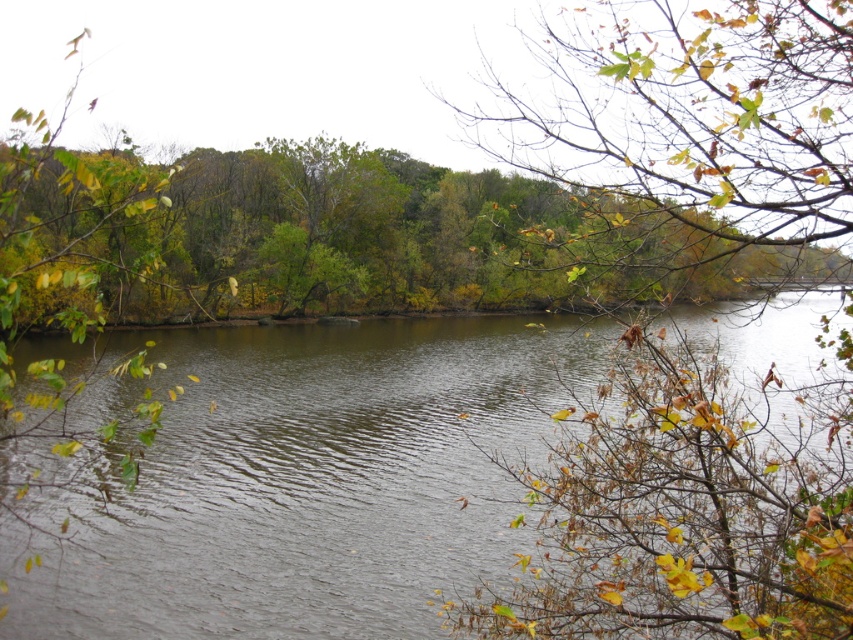
In the scene shown: Can you confirm if dark brown water at center is wider than green matte leaves at upper right?

Indeed, dark brown water at center has a greater width compared to green matte leaves at upper right.

Is dark brown water at center bigger than green matte leaves at upper right?

Yes.

Is point (18, 560) closer to camera compared to point (735, 104)?

No.

Where is `dark brown water at center`? Image resolution: width=853 pixels, height=640 pixels. dark brown water at center is located at coordinates (312, 483).

Is point (67, 580) farther from viewer compared to point (135, 248)?

That is False.

Is dark brown water at center bigger than green leafy tree at upper center?

No.

Between point (115, 628) and point (468, 196), which one is positioned behind?

The point (468, 196) is behind.

At what (x,y) coordinates should I click in order to perform the action: click on dark brown water at center. Please return your answer as a coordinate pair (x, y). Looking at the image, I should click on (312, 483).

Who is more forward, (x=844, y=193) or (x=36, y=294)?

Positioned in front is point (x=844, y=193).

Who is more distant from viewer, (567, 513) or (508, 257)?

Point (508, 257)

You are a GUI agent. You are given a task and a screenshot of the screen. Output one action in this format:
    pyautogui.click(x=<x>, y=<y>)
    Task: Click on the green matte leaves at upper right
    Image resolution: width=853 pixels, height=640 pixels.
    Given the screenshot: What is the action you would take?
    pyautogui.click(x=689, y=513)